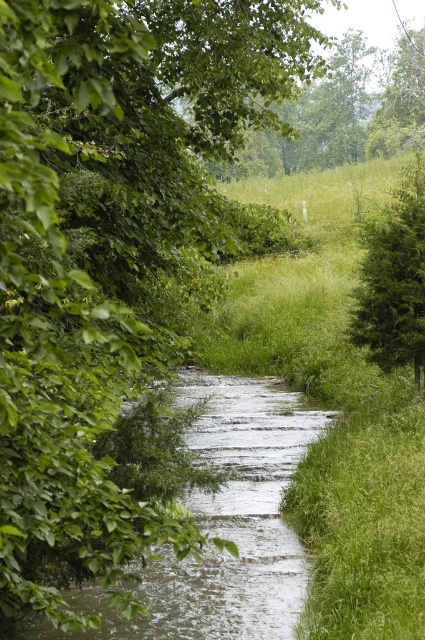
You are a hiker who wants to take a photo of both the green leafy tree at upper center and the green textured tree at right. Which tree should you stand closer to in order to capture both in the frame without zooming?

To capture both the green leafy tree at upper center and the green textured tree at right in the frame without zooming, you should stand closer to the green textured tree at right. Since the green leafy tree at upper center is taller than the green textured tree at right, positioning yourself closer to the shorter tree will help balance their sizes in the photo, ensuring both are visible within the frame.

You are planning to cross the stream using a 2 meter wide floating platform. The platform must be placed between the clear water at center and the green textured tree at right. Based on the scene, will the platform fit within the stream between these two objects?

The clear water at center is narrower than the green textured tree at right. Since the platform is 2 meters wide, it depends on the actual width of the stream between them. However, the description only states the water is narrower than the tree, not the stream width. Thus, insufficient information to determine if the platform fits.

You are standing at the edge of the stream and see a point marked at coordinates (223, 524). Based on the scene description, can you determine if this point is located on the clear water at center?

Yes, the point (223, 524) is on clear water at center according to the description.